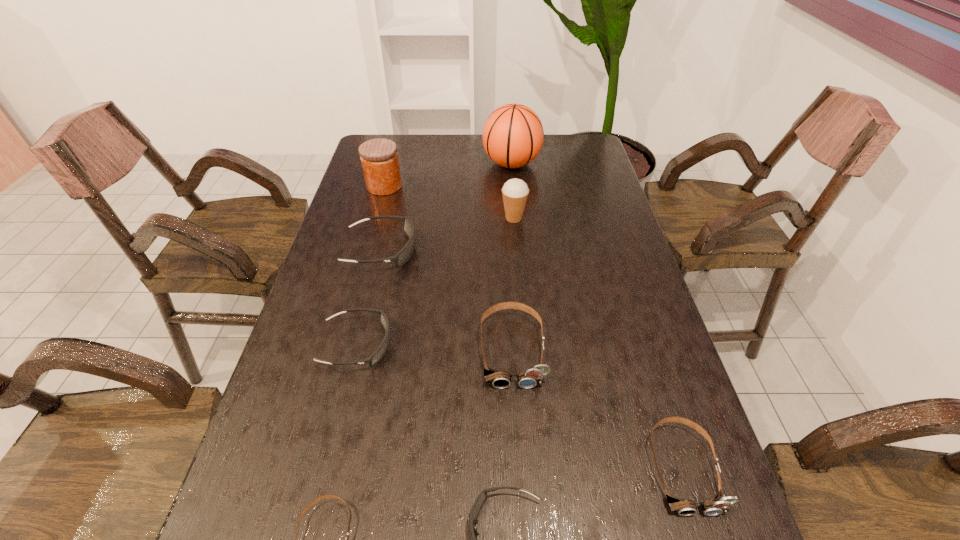
Where is `blank area at the far edge`? This screenshot has width=960, height=540. blank area at the far edge is located at coordinates (452, 140).

At what (x,y) coordinates should I click in order to perform the action: click on vacant area at the left edge. Please return your answer as a coordinate pair (x, y). This screenshot has width=960, height=540. Looking at the image, I should click on (353, 242).

The image size is (960, 540). I want to click on vacant space at the right edge of the desktop, so (x=638, y=374).

Locate an element on the screen. The height and width of the screenshot is (540, 960). free spot between the orange jar and the second nearest black goggles is located at coordinates (371, 266).

Locate an element on the screen. The image size is (960, 540). free space between the second smallest brown goggles and the third farthest object is located at coordinates (598, 343).

The image size is (960, 540). Identify the location of free point between the farthest brown goggles and the second smallest black goggles. (434, 347).

Identify the location of vacant point located between the rightmost object and the orange jar. (534, 327).

Locate an element on the screen. empty space between the second brown goggles from right to left and the orange basketball is located at coordinates (512, 256).

Locate an element on the screen. The height and width of the screenshot is (540, 960). free spot between the second farthest black goggles and the rightmost goggles is located at coordinates (519, 407).

Find the location of `the fifth closest object to the farthest black goggles`. the fifth closest object to the farthest black goggles is located at coordinates (513, 135).